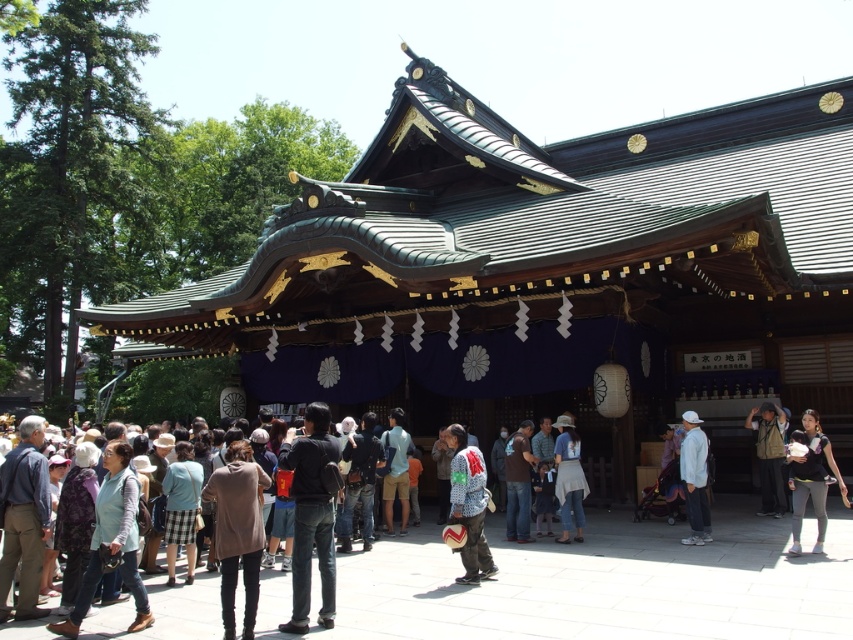
Question: Can you confirm if black fabric baby carrier at lower right is thinner than denim jacket at center?

Choices:
 (A) no
 (B) yes

Answer: (A)

Question: Where is brown woolen coat at center located in relation to light blue fabric backpack at center in the image?

Choices:
 (A) right
 (B) left

Answer: (B)

Question: Which of the following is the closest to the observer?

Choices:
 (A) (221, 518)
 (B) (561, 428)

Answer: (A)

Question: From the image, what is the correct spatial relationship of white textured jacket at center in relation to denim jeans at center?

Choices:
 (A) above
 (B) below

Answer: (A)

Question: Which point is closer to the camera?

Choices:
 (A) black fabric baby carrier at lower right
 (B) denim jeans at center
 (C) plaid fabric skirt at center

Answer: (A)

Question: Which point is closer to the camera taking this photo?

Choices:
 (A) pos(241,452)
 (B) pos(558,451)
 (C) pos(788,554)
 (D) pos(120,525)

Answer: (D)